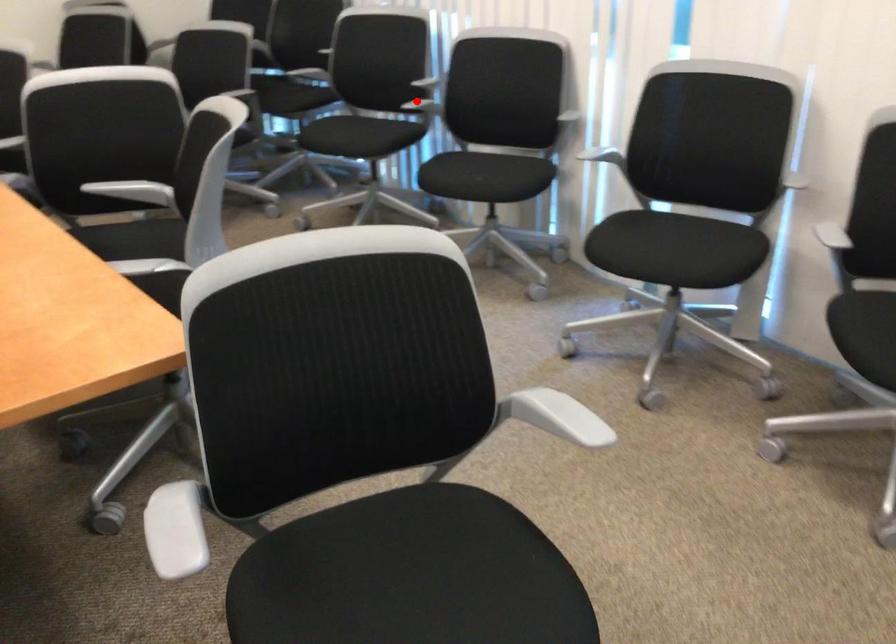
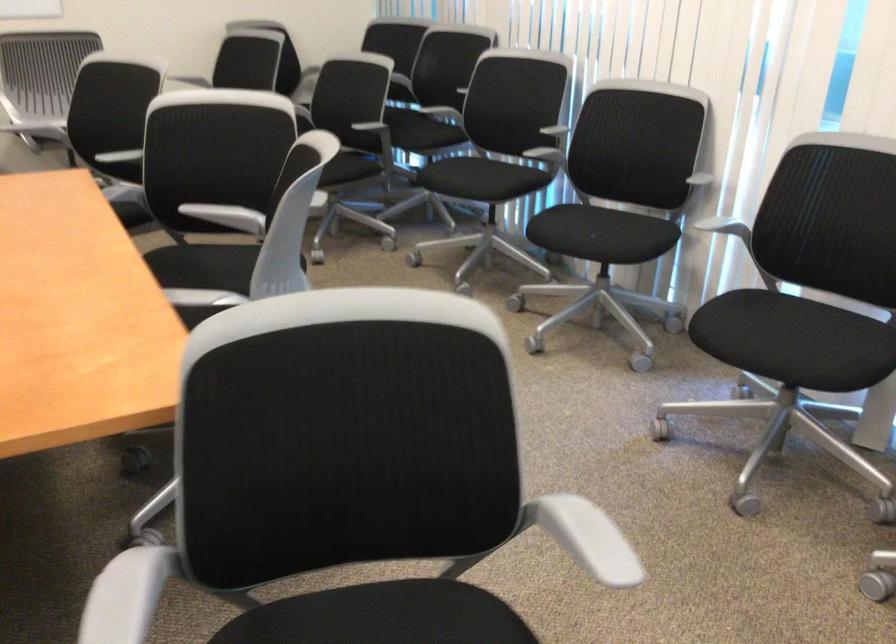
Question: I am providing you with two images of the same scene from different viewpoints. A red point is marked on the first image. Can you still see the location of the red point in image 2?

Choices:
 (A) Yes
 (B) No

Answer: (A)